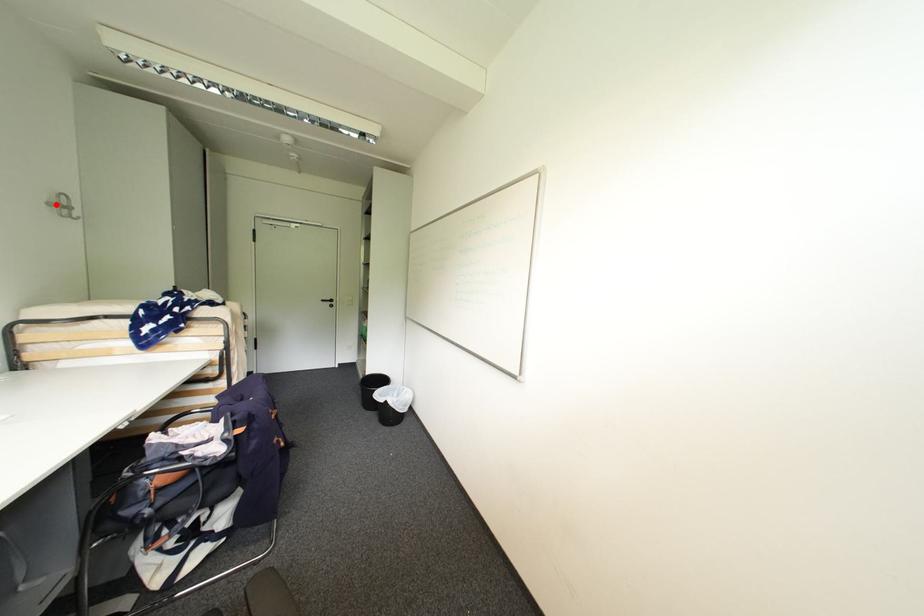
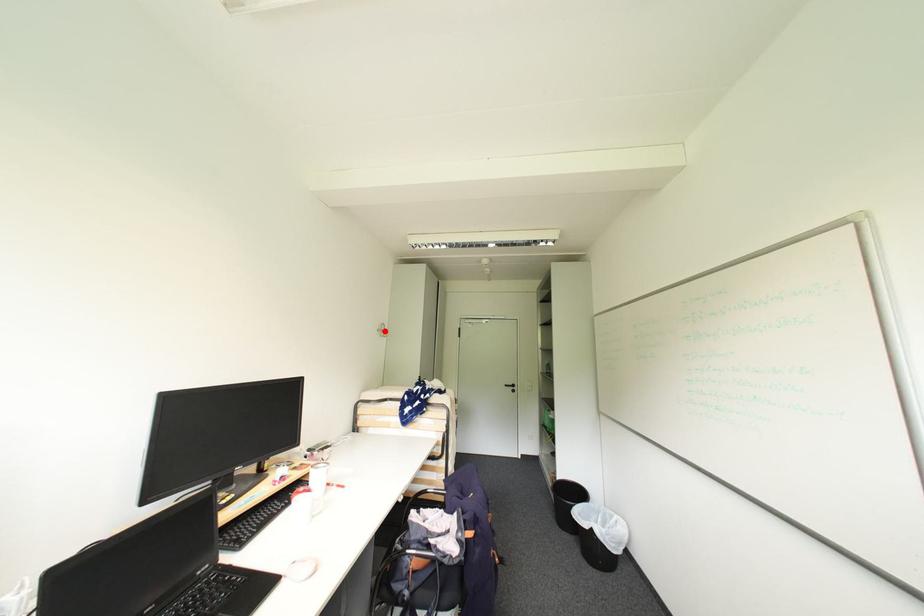
I am providing you with two images of the same scene from different viewpoints. A red point is marked on the first image and another point is marked on the second image. Is the marked point in image1 the same physical position as the marked point in image2?

Yes